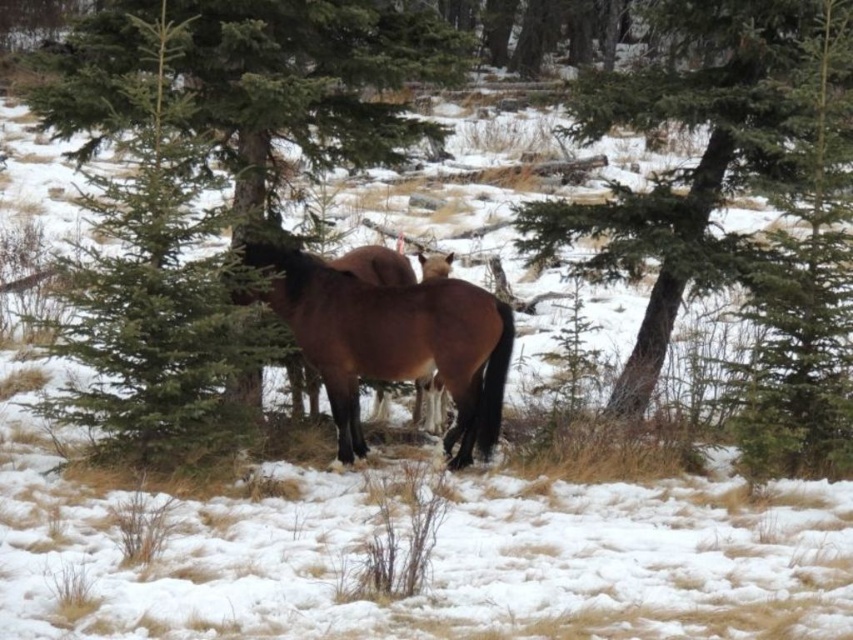
You are a hiker trying to navigate through the snowy area between the green textured tree at center and the green textured pine tree at center. Which tree should you avoid to stay on the path?

The green textured tree at center is larger in size than the green textured pine tree at center, so you should avoid the larger tree to stay on the path.

You are standing in the winter scene with two horses. You notice two points marked in the image. The first point is at coordinate (524,244) and the second point is at coordinate (329,346). Which point is closer to you?

Point (329,346) is closer to you because it is less further to the camera than point (524,244).

You are standing in the snowy landscape and want to take a photo of the green textured pine tree at center. Which direction should you face to ensure the tree is in the center of your photo?

The green textured pine tree at center is located at point (310, 81), so you should face towards the center of the image to capture it in the photo.